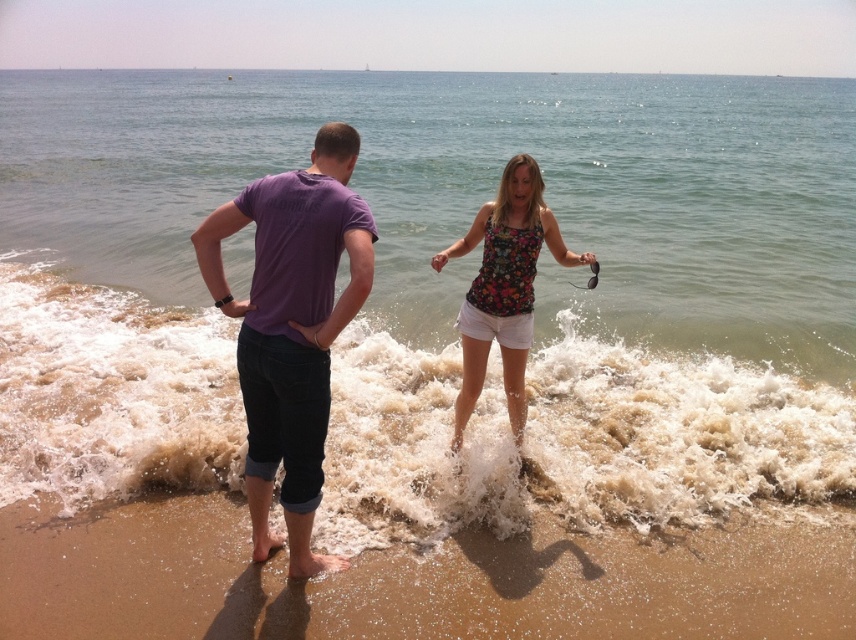
You are standing at the shoreline and want to take a photo of the purple cotton shirt at center and the clear water at lower center. Which object should you position closer to the camera to ensure both are in the frame?

You should position the purple cotton shirt at center closer to the camera because the clear water at lower center is to the right of it, so moving the shirt forward will keep both in frame.